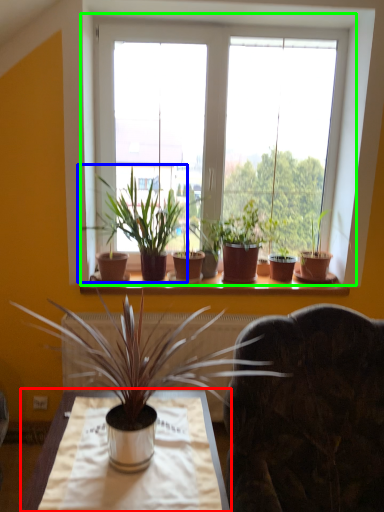
Question: Which is farther away from table (highlighted by a red box)? houseplant (highlighted by a blue box) or window (highlighted by a green box)?

Choices:
 (A) houseplant
 (B) window

Answer: (B)